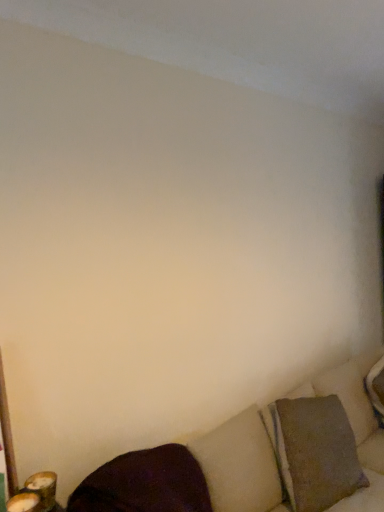
Question: Is textured beige couch at lower right in front of or behind textured brown pillow at lower right, which is counted as the first pillow, starting from the back, in the image?

Choices:
 (A) front
 (B) behind

Answer: (A)

Question: From a real-world perspective, relative to textured brown pillow at lower right, which is counted as the first pillow, starting from the back, is textured beige couch at lower right vertically above or below?

Choices:
 (A) below
 (B) above

Answer: (B)

Question: Estimate the real-world distances between objects in this image. Which object is farther from the textured brown pillow at lower right, the second pillow in the front-to-back sequence?

Choices:
 (A) textured beige couch at lower right
 (B) dark matte pillow at lower left, which ranks as the second pillow in back-to-front order

Answer: (B)

Question: Based on their relative distances, which object is nearer to the dark matte pillow at lower left, which is the 1th pillow in front-to-back order?

Choices:
 (A) textured brown pillow at lower right, arranged as the first pillow when viewed from the right
 (B) textured beige couch at lower right

Answer: (B)